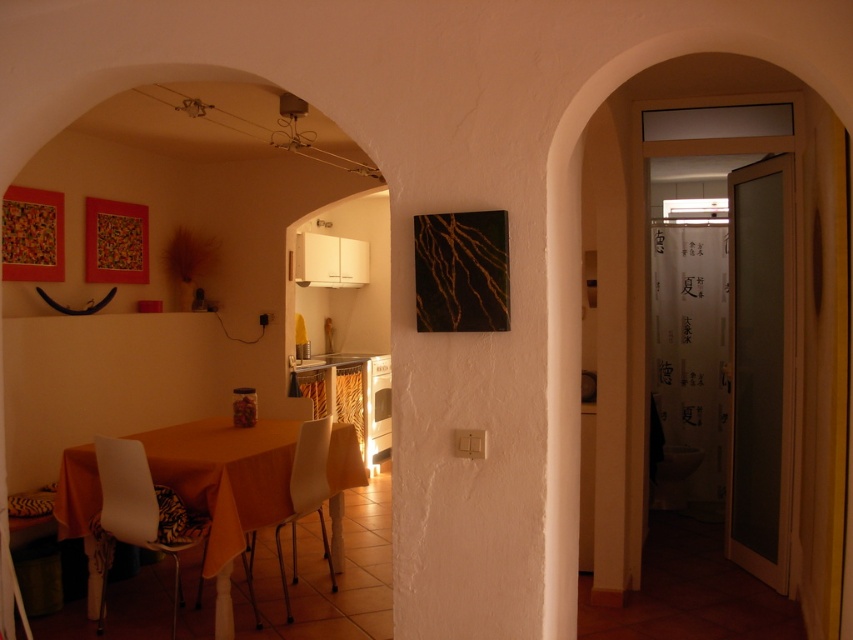
You are standing at the camera position and want to grab the jar on the table. The white plastic chair at lower left is in your way. Can you walk around it to reach the table?

The distance between you and the white plastic chair at lower left is 2.83 meters, so you have enough space to walk around it and reach the table.

You are sitting at the dining table and want to move to the white plastic chair at center. Which direction should you move relative to the white plastic chair at lower left?

You should move behind the white plastic chair at lower left to reach the white plastic chair at center, since the white plastic chair at lower left is in front of the white plastic chair at center.

You are sitting at the dining table and want to move to the white plastic chair at center. Which direction should you move relative to the white plastic chair at lower left?

You should move to the right relative to the white plastic chair at lower left because the white plastic chair at center is to the right of it.